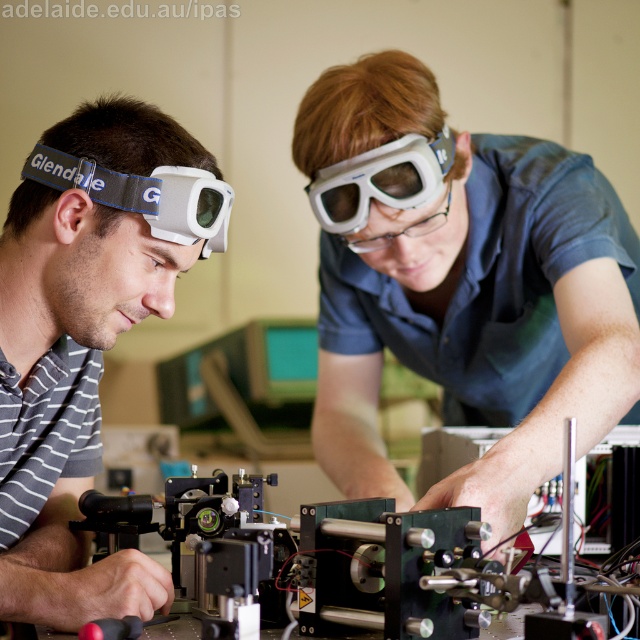
Question: Estimate the real-world distances between objects in this image. Which object is farther from the white matte goggles at left?

Choices:
 (A) white matte goggles at upper center
 (B) white matte/glossy goggles at left
 (C) matte white goggles at center
 (D) metallic black mechanical device at center

Answer: (C)

Question: Which of these objects is positioned farthest from the white matte goggles at left?

Choices:
 (A) metallic black mechanical device at center
 (B) white matte goggles at upper center

Answer: (B)

Question: Which point is closer to the camera?

Choices:
 (A) white matte goggles at upper center
 (B) matte white goggles at center

Answer: (B)

Question: Is white matte goggles at left in front of white matte goggles at upper center?

Choices:
 (A) yes
 (B) no

Answer: (A)

Question: Can you confirm if matte white goggles at center is smaller than white matte goggles at upper center?

Choices:
 (A) yes
 (B) no

Answer: (B)

Question: Is white matte goggles at left behind metallic black mechanical device at center?

Choices:
 (A) yes
 (B) no

Answer: (A)